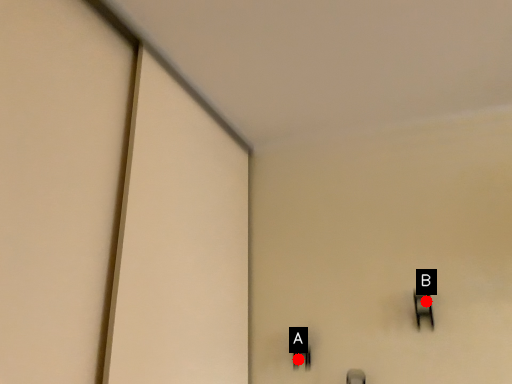
Question: Two points are circled on the image, labeled by A and B beside each circle. Which point is further to the camera?

Choices:
 (A) A is further
 (B) B is further

Answer: (A)